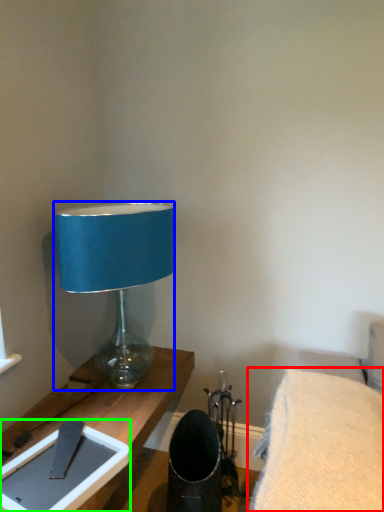
Question: Which object is positioned farthest from furniture (highlighted by a red box)? Select from lamp (highlighted by a blue box) and tablet computer (highlighted by a green box).

Choices:
 (A) lamp
 (B) tablet computer

Answer: (A)